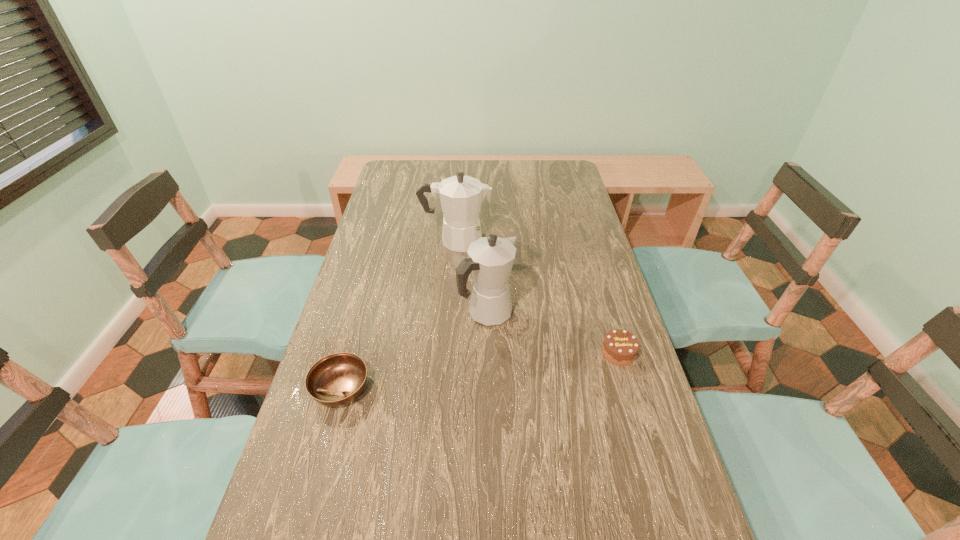
At what (x,y) coordinates should I click in order to perform the action: click on vacant space that satisfies the following two spatial constraints: 1. on the back side of the shortest object; 2. on the left side of the second farthest object. Please return your answer as a coordinate pair (x, y). The image size is (960, 540). Looking at the image, I should click on (361, 314).

Identify the location of free spot that satisfies the following two spatial constraints: 1. at the spout of the farthest object; 2. on the right side of the nearer coffeepot. (450, 314).

Locate an element on the screen. Image resolution: width=960 pixels, height=540 pixels. vacant point that satisfies the following two spatial constraints: 1. on the back side of the nearer coffeepot; 2. at the spout of the farther coffeepot is located at coordinates (486, 240).

Find the location of a particular element. This screenshot has width=960, height=540. free space that satisfies the following two spatial constraints: 1. at the spout of the farthest object; 2. on the front side of the shortest object is located at coordinates (445, 388).

Find the location of a particular element. The width and height of the screenshot is (960, 540). free location that satisfies the following two spatial constraints: 1. on the back side of the nearer coffeepot; 2. on the left side of the soup bowl is located at coordinates (361, 314).

Find the location of a particular element. The width and height of the screenshot is (960, 540). vacant space that satisfies the following two spatial constraints: 1. at the spout of the second shortest object; 2. on the right side of the farthest object is located at coordinates (448, 353).

Find the location of a particular element. The image size is (960, 540). vacant space that satisfies the following two spatial constraints: 1. at the spout of the farthest object; 2. on the right side of the third nearest object is located at coordinates click(450, 314).